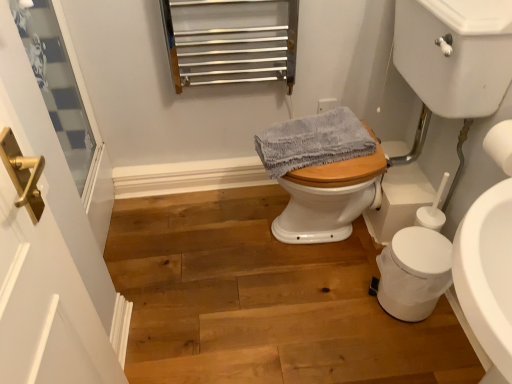
This screenshot has height=384, width=512. Find the location of `vacant space that is in between white glossy sink at center right and white matte trash can at lower right`. vacant space that is in between white glossy sink at center right and white matte trash can at lower right is located at coordinates (341, 296).